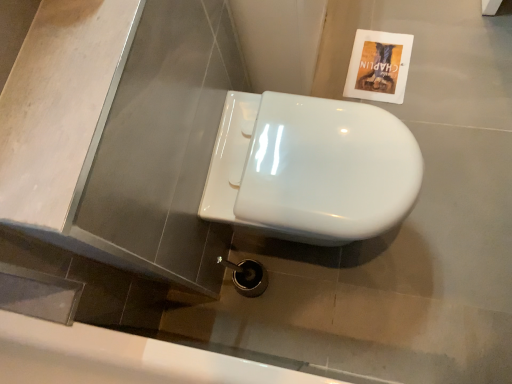
Question: Is white glossy toilet at center to the left or to the right of matte paper flyer at upper right in the image?

Choices:
 (A) right
 (B) left

Answer: (B)

Question: Looking at the image, does white glossy toilet at center seem bigger or smaller compared to matte paper flyer at upper right?

Choices:
 (A) big
 (B) small

Answer: (A)

Question: Estimate the real-world distances between objects in this image. Which object is closer to the white glossy bath at lower center?

Choices:
 (A) white glossy toilet at center
 (B) matte paper flyer at upper right

Answer: (A)

Question: Considering the real-world distances, which object is closest to the white glossy bath at lower center?

Choices:
 (A) matte paper flyer at upper right
 (B) white glossy toilet at center

Answer: (B)